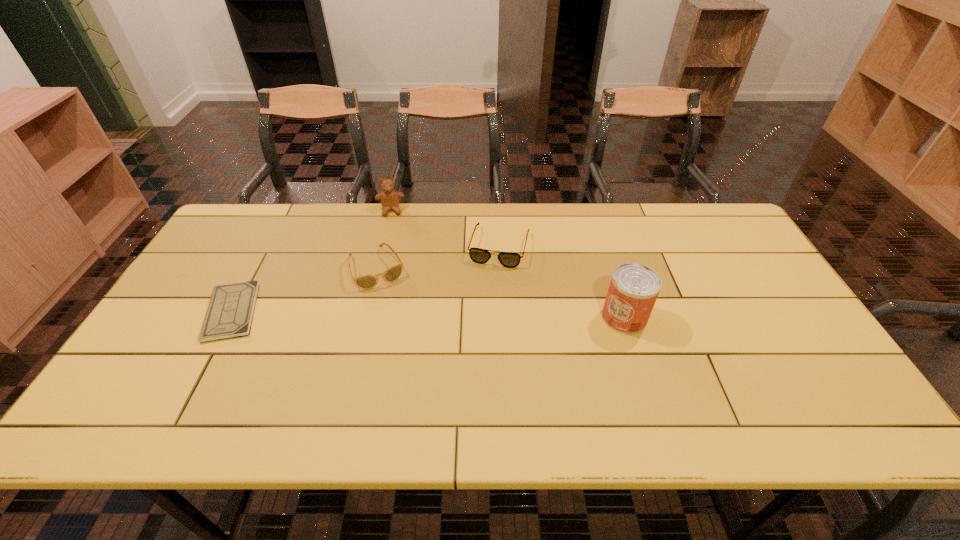
Locate an element on the screen. empty location between the teddy bear and the sunglasses is located at coordinates (384, 239).

The height and width of the screenshot is (540, 960). Find the location of `free spot between the sunglasses and the tallest object`. free spot between the sunglasses and the tallest object is located at coordinates (500, 293).

Find the location of a particular element. This screenshot has height=540, width=960. free space between the rightmost object and the fourth object from left to right is located at coordinates (562, 282).

What are the coordinates of `vacant region between the sunglasses and the fourth shortest object` in the screenshot? It's located at (384, 239).

The image size is (960, 540). In order to click on vacant area that lies between the checkbook and the teddy bear in this screenshot , I will do `click(311, 261)`.

This screenshot has height=540, width=960. In order to click on free space between the sunglasses and the leftmost object in this screenshot , I will do `click(304, 290)`.

This screenshot has width=960, height=540. Identify the location of free space between the leftmost object and the can. (428, 315).

Locate an element on the screen. The height and width of the screenshot is (540, 960). free space between the teddy bear and the sunglasses is located at coordinates (384, 239).

You are a GUI agent. You are given a task and a screenshot of the screen. Output one action in this format:
    pyautogui.click(x=<x>, y=<y>)
    Task: Click on the object that ranks as the second closest to the farthest object
    This screenshot has width=960, height=540.
    Given the screenshot: What is the action you would take?
    [x=507, y=259]

The width and height of the screenshot is (960, 540). I want to click on the closest object to the sunglasses, so click(x=389, y=197).